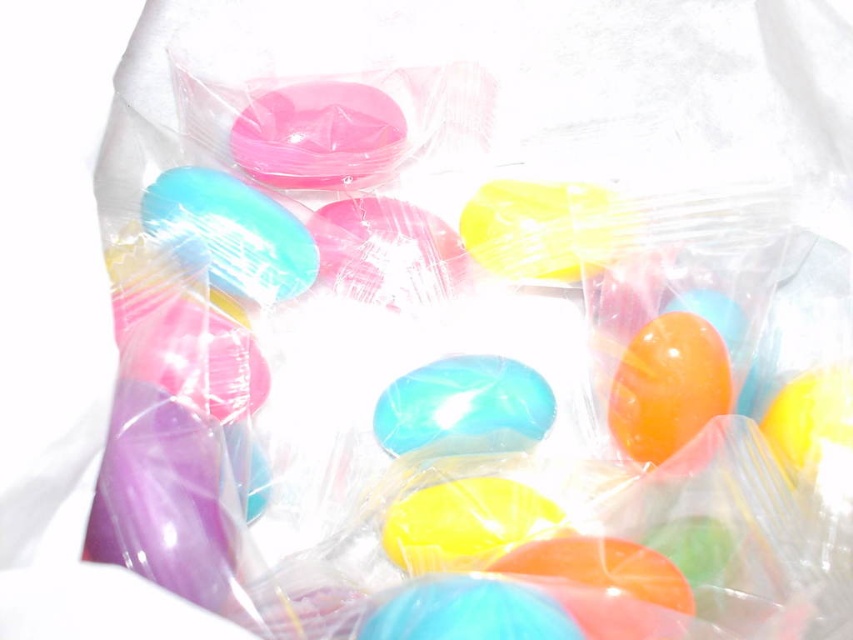
You are a candy seller who wants to arrange candies in a display case. You have two candies to place next to each other. The matte pink candy at upper center and the translucent glossy jelly bean at center. Which candy should you choose if you want to place a wider candy on the left side of the display?

You should place the matte pink candy at upper center on the left side of the display because it is wider than the translucent glossy jelly bean at center.

Consider the image. You are holding a candy jar that is 32 inches away from you. You see the matte pink candy at upper center. Can you reach it without moving closer?

The matte pink candy at upper center is 31.92 inches from the viewer, so yes, you can reach it without moving closer since it is slightly closer than the jar.

You are a photographer trying to capture the candies in the image. You notice two points on the candies at coordinates point (376, 122) and point (390, 412). Which point is closer to your camera lens?

Point (376, 122) is further to the camera than point (390, 412), so the point closer to the camera lens is point (390, 412).